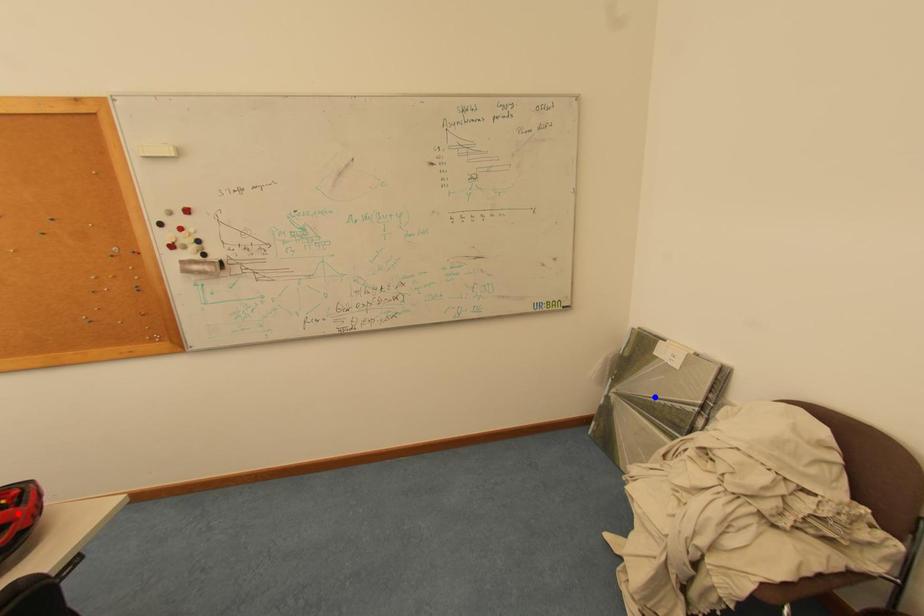
Question: In the image, two points are highlighted. Which point is nearer to the camera? Reply with the corresponding letter.

Choices:
 (A) blue point
 (B) red point

Answer: (B)